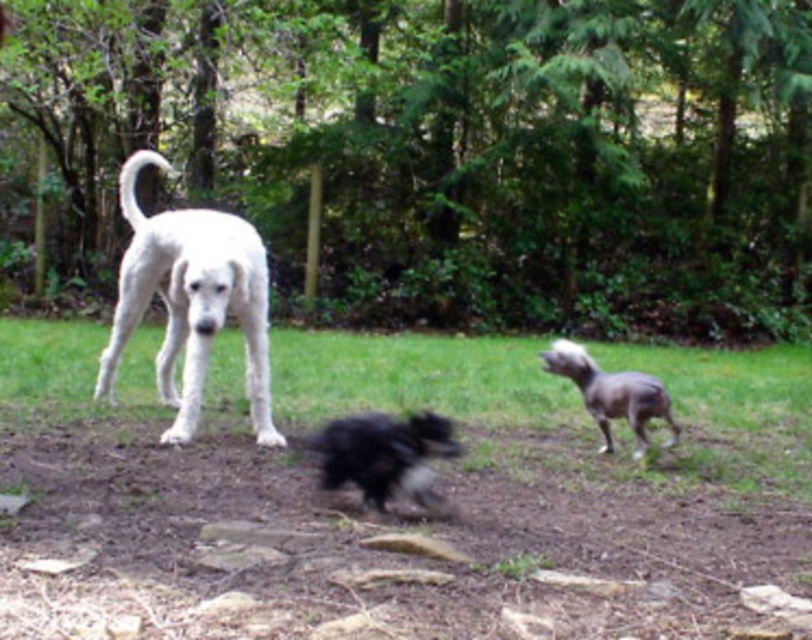
Between white fur dog at left and shaggy black dog at center, which one has less height?

Standing shorter between the two is shaggy black dog at center.

Is white fur dog at left smaller than shaggy black dog at center?

Actually, white fur dog at left might be larger than shaggy black dog at center.

Image resolution: width=812 pixels, height=640 pixels. What do you see at coordinates (191, 300) in the screenshot?
I see `white fur dog at left` at bounding box center [191, 300].

Image resolution: width=812 pixels, height=640 pixels. Find the location of `white fur dog at left`. white fur dog at left is located at coordinates (191, 300).

Can you confirm if brown dirt field at center is positioned to the right of shaggy black dog at center?

Indeed, brown dirt field at center is positioned on the right side of shaggy black dog at center.

Is brown dirt field at center closer to the viewer compared to shaggy black dog at center?

Yes, brown dirt field at center is in front of shaggy black dog at center.

Is point (443, 339) positioned in front of point (374, 444)?

No.

Locate an element on the screen. brown dirt field at center is located at coordinates (x=402, y=522).

Is shaggy black dog at center below silky gray dog at center?

Yes, shaggy black dog at center is below silky gray dog at center.

Is shaggy black dog at center wider than silky gray dog at center?

Incorrect, shaggy black dog at center's width does not surpass silky gray dog at center's.

Between point (335, 465) and point (609, 442), which one is positioned in front?

Point (335, 465)

This screenshot has height=640, width=812. I want to click on shaggy black dog at center, so click(x=387, y=456).